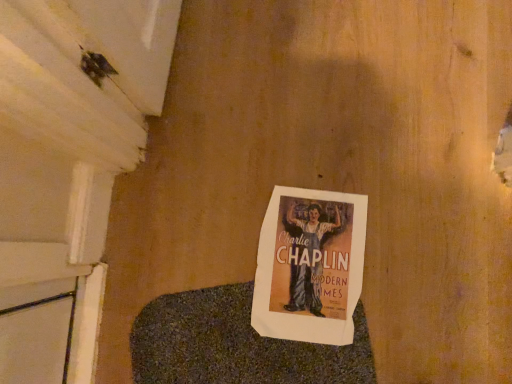
Identify the location of free space to the right of blue textured blanket at center. (421, 280).